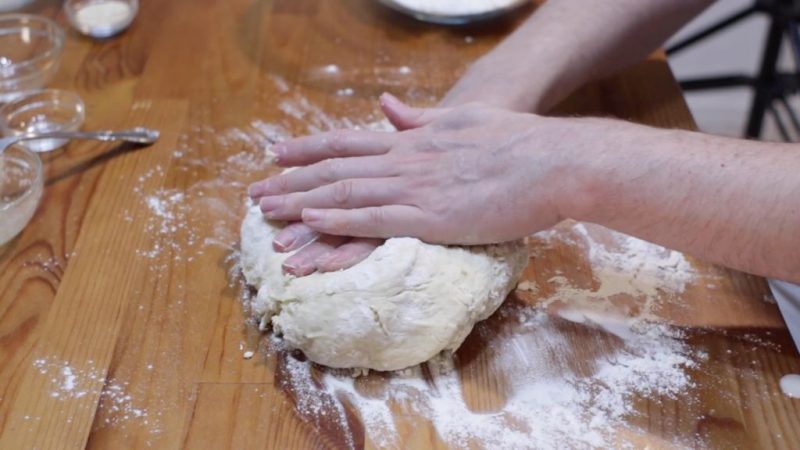
What are the coordinates of `orange/brown oak wood grain` in the screenshot? It's located at (56, 273).